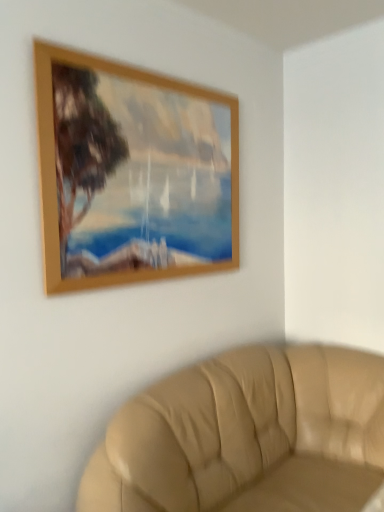
Find the location of a particular element. The image size is (384, 512). tan leather couch at lower right is located at coordinates (247, 436).

The width and height of the screenshot is (384, 512). Describe the element at coordinates (247, 436) in the screenshot. I see `tan leather couch at lower right` at that location.

At what (x,y) coordinates should I click in order to perform the action: click on tan leather couch at lower right. Please return your answer as a coordinate pair (x, y). Image resolution: width=384 pixels, height=512 pixels. Looking at the image, I should click on (247, 436).